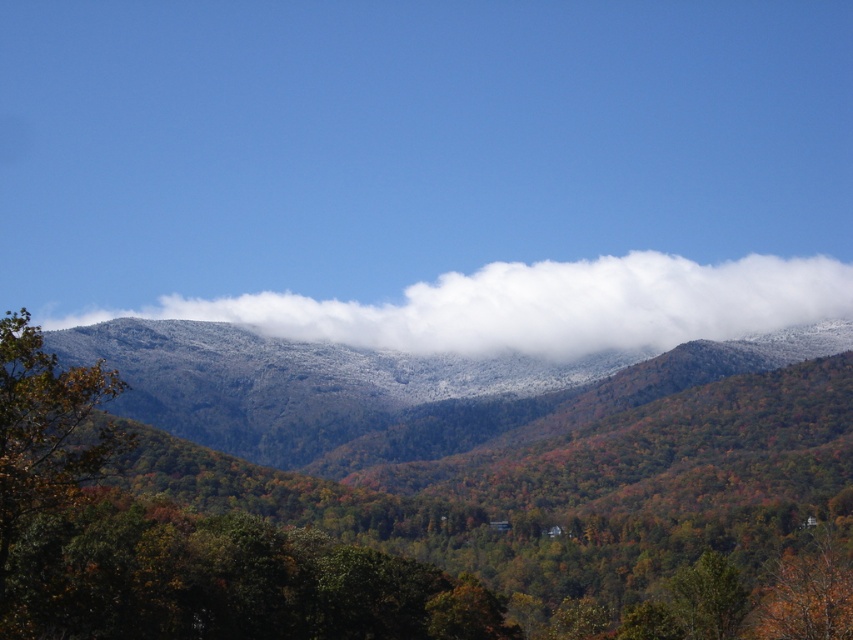
You are standing in the mountain landscape and see two points marked on the image. The first point is at coordinates point (619, 429) and the second is at point (712, 285). Which point is closer to you?

Point (619, 429) is in front of point (712, 285), so it is closer to you.

You are a hiker standing at the base of the mountain, and you want to take a photo of the green matte forest at center and the white fluffy cloud at upper center. Can you fit both in your camera frame if the maximum distance your camera can capture between two objects is 80 meters?

The green matte forest at center is 82.70 meters from the white fluffy cloud at upper center, which exceeds the camera frame limit of 80 meters. Therefore, both cannot be captured in the same photo.